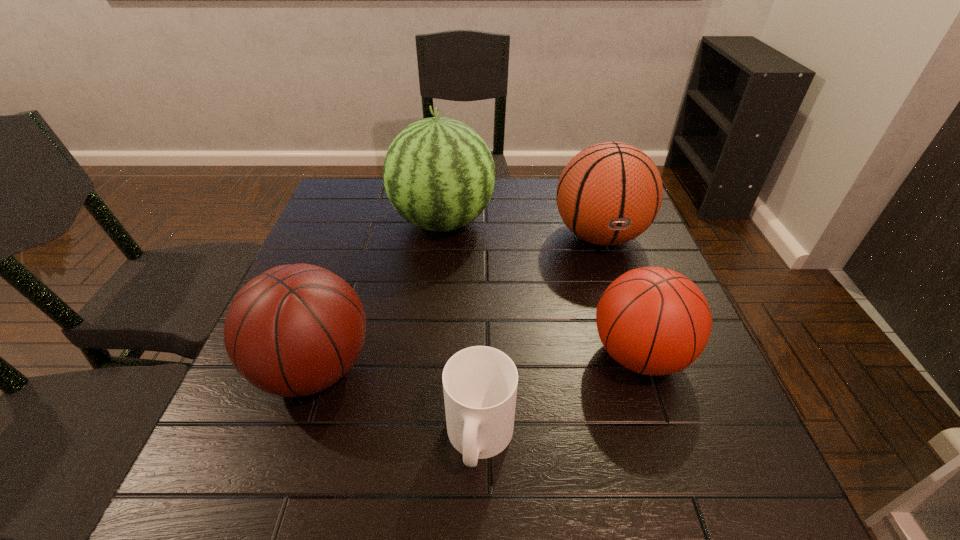
Find the location of a particular element. The height and width of the screenshot is (540, 960). object present at the left edge is located at coordinates (295, 330).

Identify the location of object that is positioned at the far right corner. (609, 193).

The image size is (960, 540). I want to click on vacant space at the far edge of the desktop, so click(533, 195).

Locate an element on the screen. The width and height of the screenshot is (960, 540). vacant space at the near edge of the desktop is located at coordinates (481, 510).

This screenshot has height=540, width=960. In the image, there is a desktop. Find the location of `vacant space at the left edge`. vacant space at the left edge is located at coordinates (340, 235).

In the image, there is a desktop. At what (x,y) coordinates should I click in order to perform the action: click on free space at the right edge. Please return your answer as a coordinate pair (x, y). This screenshot has width=960, height=540. Looking at the image, I should click on (733, 430).

Find the location of a particular element. The width and height of the screenshot is (960, 540). free space at the far left corner of the desktop is located at coordinates (359, 184).

The width and height of the screenshot is (960, 540). In order to click on vacant space at the near left corner of the desktop in this screenshot , I will do `click(228, 516)`.

Image resolution: width=960 pixels, height=540 pixels. What are the coordinates of `vacant space that's between the leftmost basketball and the watermelon` in the screenshot? It's located at (378, 295).

Find the location of a particular element. vacant space that is in between the leftmost basketball and the shortest object is located at coordinates (397, 403).